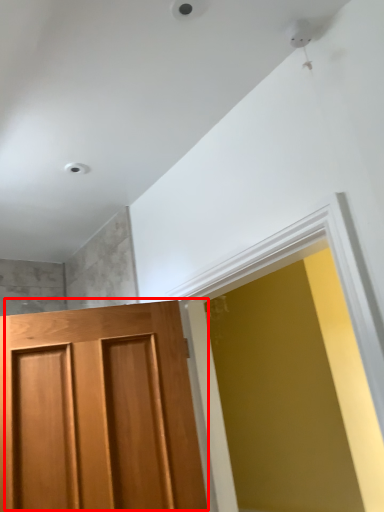
Question: In this image, where is door (annotated by the red box) located relative to window?

Choices:
 (A) right
 (B) left

Answer: (B)